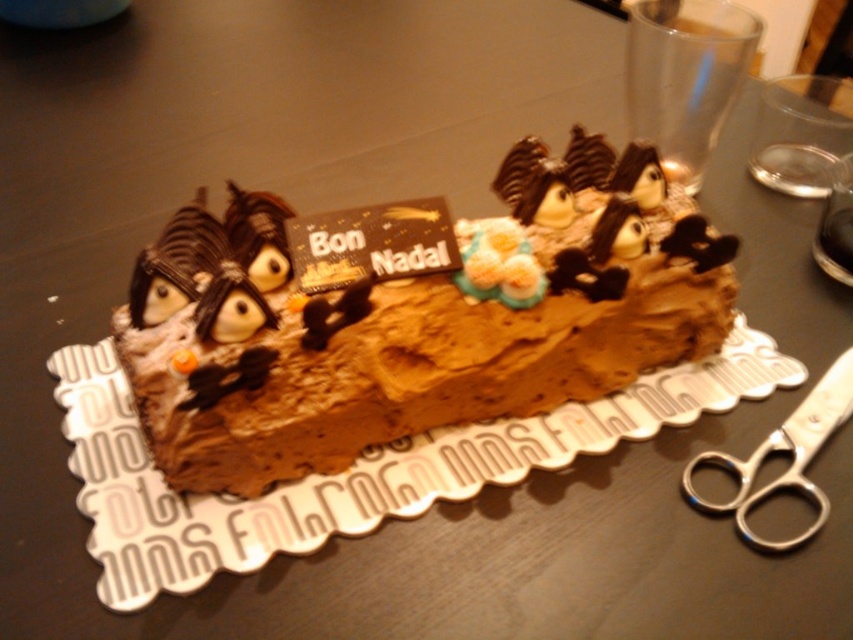
You are at the center of the image and want to place a small candle exactly at the center of the chocolate frosted cake at center. Given that the point coordinates are normalized between 0 and 1, can you confirm if the point at coordinates point (428, 323) is the center of the chocolate frosted cake at center?

Yes, the point at coordinates point (428, 323) is the center of the chocolate frosted cake at center as indicated in the description.

You are a guest at a Christmas party and see the chocolate frosted cake at center and the silver metallic scissors at lower right on the table. The host asks if the cake is taller than the scissors. How do you respond?

The chocolate frosted cake at center is much taller than the silver metallic scissors at lower right, so yes, the cake is taller than the scissors.

You are a guest at a Christmas party and see the chocolate frosted cake at center and the silver metallic scissors at lower right. Which object is closer to you?

The silver metallic scissors at lower right are closer to you because the chocolate frosted cake at center is positioned over them, indicating it is in front.